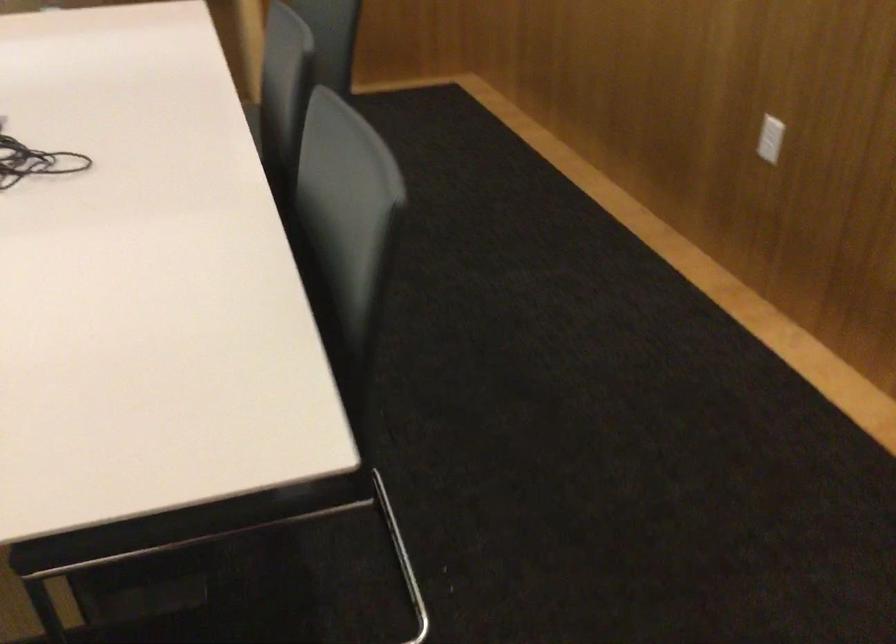
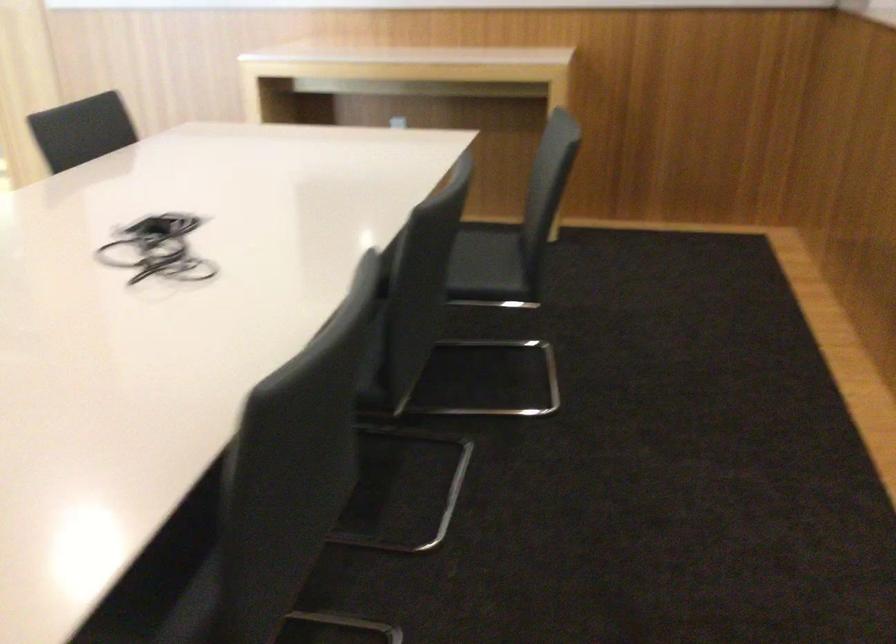
Question: How did the camera likely rotate?

Choices:
 (A) Left
 (B) Right
 (C) Up
 (D) Down

Answer: (A)